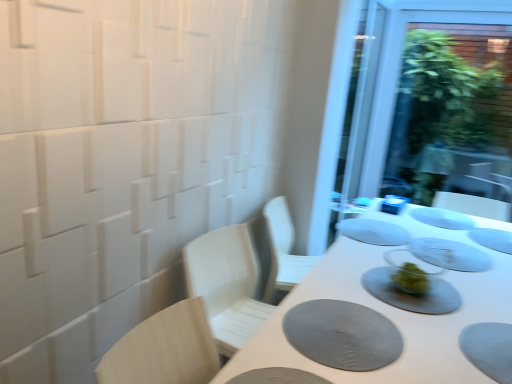
Where is `vacant space in between matte gray placemat at center, the first tableware in the front-to-back sequence, and gray textured placemat at lower right`? vacant space in between matte gray placemat at center, the first tableware in the front-to-back sequence, and gray textured placemat at lower right is located at coordinates (371, 304).